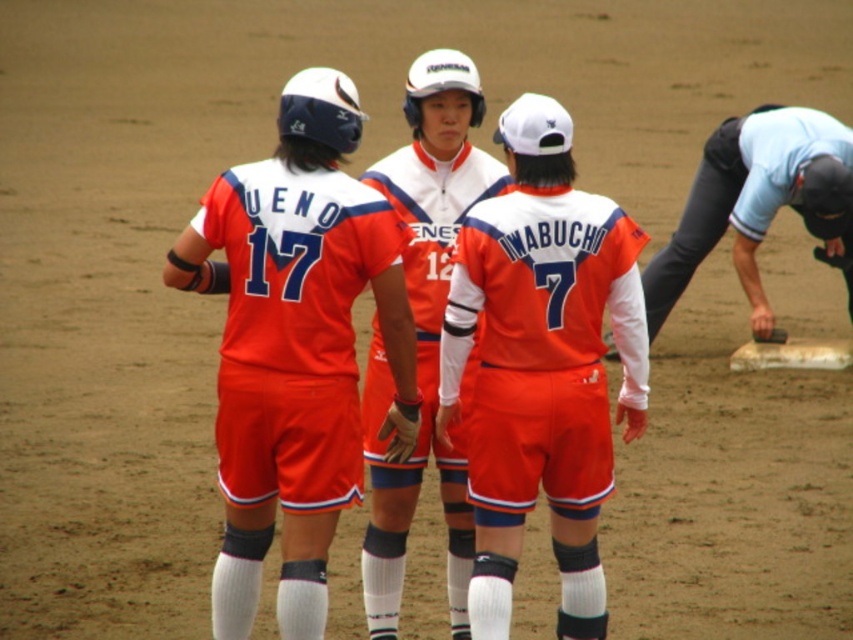
Is orange uniformed players at center below orange jersey at center?

No, orange uniformed players at center is not below orange jersey at center.

Does orange uniformed players at center have a greater height compared to orange jersey at center?

No.

You are a GUI agent. You are given a task and a screenshot of the screen. Output one action in this format:
    pyautogui.click(x=<x>, y=<y>)
    Task: Click on the orange uniformed players at center
    
    Given the screenshot: What is the action you would take?
    pyautogui.click(x=437, y=170)

Find the location of a particular element. The height and width of the screenshot is (640, 853). orange uniformed players at center is located at coordinates (437, 170).

Measure the distance between orange uniformed players at center and light blue shirt at right.

orange uniformed players at center and light blue shirt at right are 4.89 meters apart from each other.

Does orange uniformed players at center have a lesser height compared to light blue shirt at right?

Yes, orange uniformed players at center is shorter than light blue shirt at right.

Between point (444, 205) and point (850, 285), which one is positioned in front?

Positioned in front is point (444, 205).

Find the location of `orange uniformed players at center`. orange uniformed players at center is located at coordinates pyautogui.click(x=437, y=170).

Is orange fabric jersey at center behind orange jersey at center?

No.

Does point (379, 196) come in front of point (407, 496)?

Yes, it is in front of point (407, 496).

Locate an element on the screen. orange fabric jersey at center is located at coordinates (294, 372).